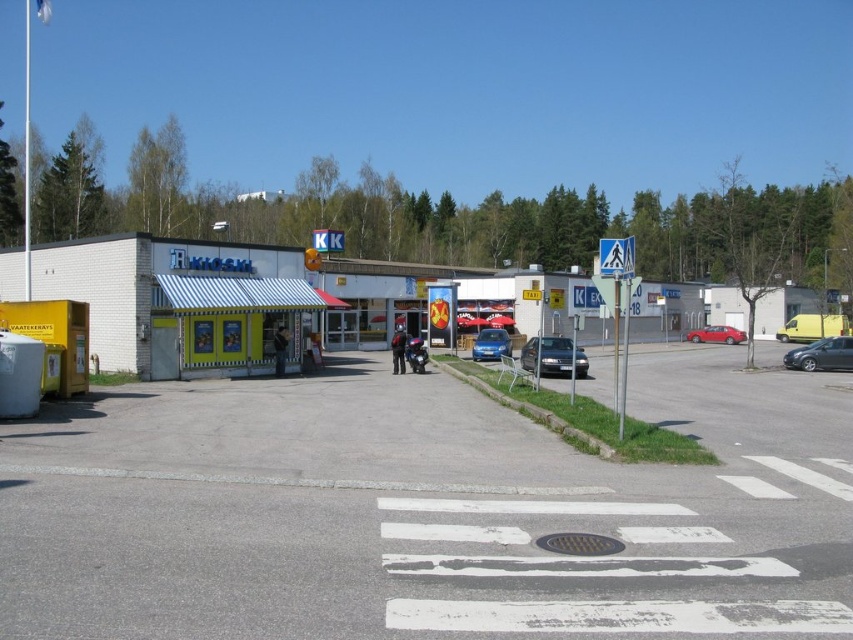
Question: Which object is closer to the camera taking this photo?

Choices:
 (A) silver metallic hatchback at lower right
 (B) satin black sedan at center
 (C) asphalt at center
 (D) red matte car at center

Answer: (C)

Question: Among these points, which one is nearest to the camera?

Choices:
 (A) (838, 353)
 (B) (718, 342)
 (C) (309, 310)

Answer: (C)

Question: Is satin black sedan at center below red matte car at center?

Choices:
 (A) no
 (B) yes

Answer: (B)

Question: Can you confirm if green striped awning at center is positioned above silver metallic hatchback at lower right?

Choices:
 (A) no
 (B) yes

Answer: (B)

Question: Among these points, which one is nearest to the camera?

Choices:
 (A) (195, 317)
 (B) (585, 369)
 (C) (485, 342)

Answer: (A)

Question: From the image, what is the correct spatial relationship of asphalt at center in relation to blue metallic car at center?

Choices:
 (A) left
 (B) right

Answer: (A)